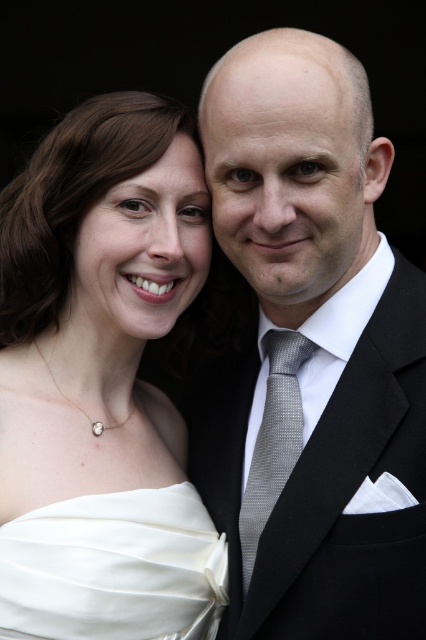
You are a photographer adjusting the lighting for a close portrait. You need to ensure the matte silver tie at center and the satin white dress at lower left are both well lit. Considering their positions, which object should you focus the light on first to ensure proper exposure?

The matte silver tie at center should be focused on first because it is positioned closer to the center of the image, making it a focal point that requires balanced lighting to ensure both it and the satin white dress at lower left are properly exposed.

You are a photographer adjusting the focus on your camera. You have two points in the image to focus on, point [37,566] and point [284,384]. Which point should you focus on to capture the foreground subject clearly?

Point [37,566] is closer to the camera than point [284,384], so you should focus on point [37,566] to capture the foreground subject clearly.